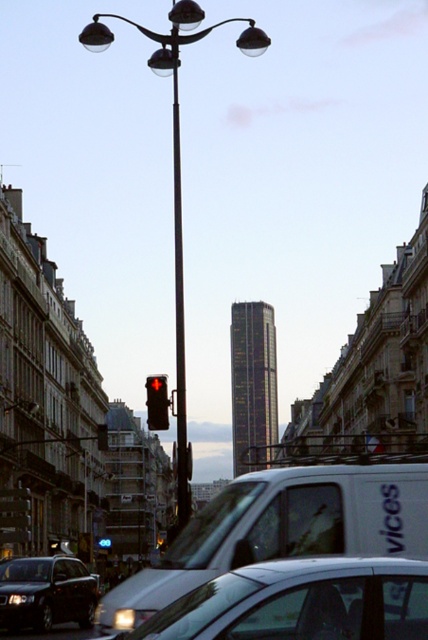
You are a pedestrian standing at the crosswalk and want to cross the street. There is a white matte van at center and a shiny black sedan at lower left. Which vehicle is closer to you?

The white matte van at center is closer to the viewer than the shiny black sedan at lower left, so the white matte van at center is closer to you.

You are a delivery driver who needs to park your white matte van at center in a specific spot. The parking spot is located at coordinates point 0.828, 0.657. Based on the scene, can you confirm if your van is already parked correctly?

The white matte van at center is positioned exactly at point (281, 529), so it is parked correctly in the designated spot.

You are standing in the urban street scene described. You notice two points marked in the image. The first point is at coordinates point (425, 611) and the second is at point (18, 604). Which of these points is nearer to your current position?

Point (425, 611) is closer to the camera than point (18, 604), so the first point is nearer to your current position.